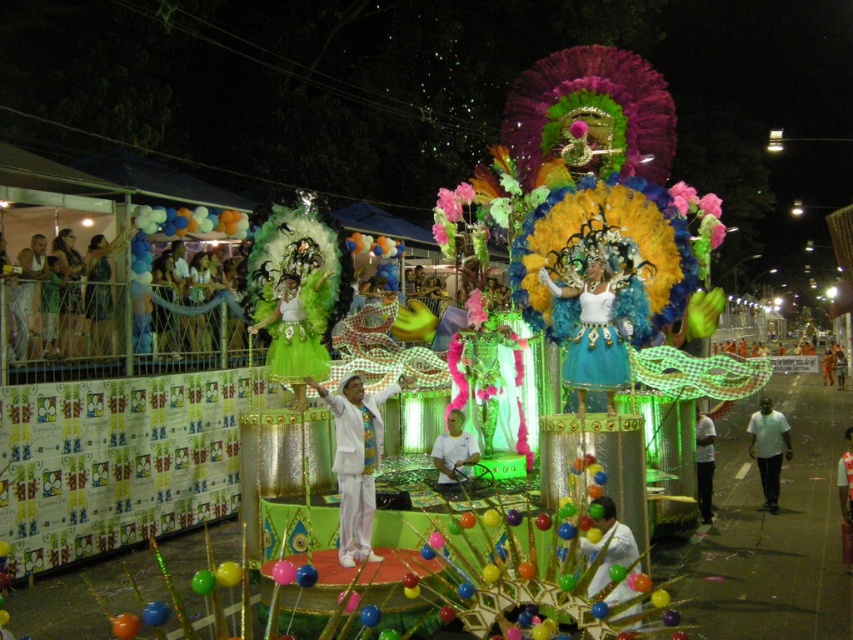
Does white fabric at center appear over white cotton shirt at center?

Yes.

Between white fabric at center and white cotton shirt at center, which one appears on the left side from the viewer's perspective?

From the viewer's perspective, white fabric at center appears more on the left side.

The image size is (853, 640). What are the coordinates of `white fabric at center` in the screenshot? It's located at (454, 452).

Is turquoise fabric costume at center behind white satin dress at center?

No, turquoise fabric costume at center is in front of white satin dress at center.

Between turquoise fabric costume at center and white satin dress at center, which one appears on the right side from the viewer's perspective?

white satin dress at center

Is point (595, 278) closer to camera compared to point (840, 456)?

Yes, it is in front of point (840, 456).

Where is `turquoise fabric costume at center`? The width and height of the screenshot is (853, 640). turquoise fabric costume at center is located at coordinates (593, 337).

Is point (628, 330) closer to camera compared to point (601, 545)?

No, it is behind (601, 545).

Does point (589, 333) lie behind point (628, 566)?

Yes, point (589, 333) is farther from viewer.

Between point (606, 282) and point (619, 600), which one is positioned in front?

Positioned in front is point (619, 600).

The width and height of the screenshot is (853, 640). I want to click on turquoise fabric costume at center, so click(593, 337).